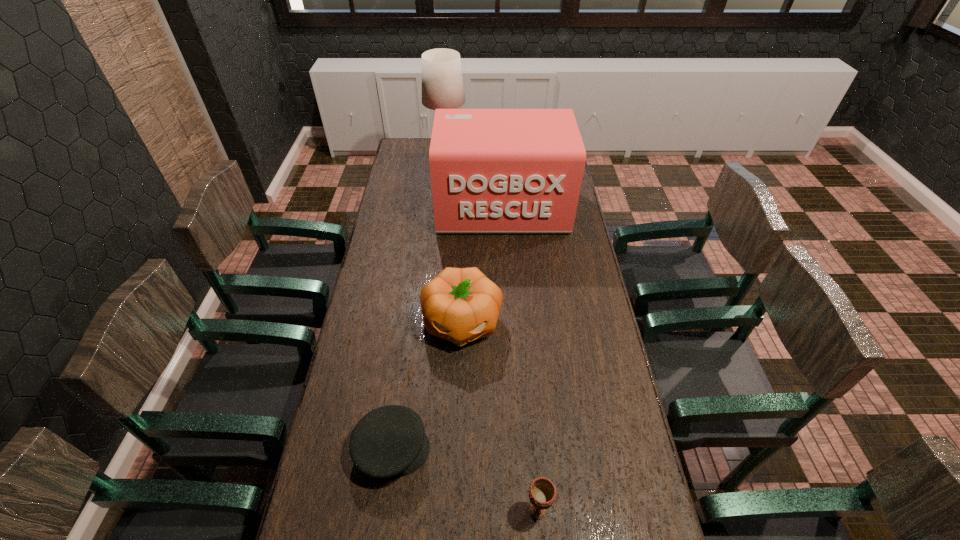
The image size is (960, 540). What are the coordinates of `object that is the third nearest to the second farthest object` in the screenshot? It's located at (389, 441).

At what (x,y) coordinates should I click in order to perform the action: click on object identified as the closest to the second tallest object. Please return your answer as a coordinate pair (x, y). The height and width of the screenshot is (540, 960). Looking at the image, I should click on (442, 83).

Find the location of a particular element. Image resolution: width=960 pixels, height=540 pixels. vacant point that satisfies the following two spatial constraints: 1. on the front-facing side of the beret; 2. on the back side of the nearest object is located at coordinates (384, 510).

At what (x,y) coordinates should I click in order to perform the action: click on free region that satisfies the following two spatial constraints: 1. on the surface of the nearest object where the text is embossed; 2. on the right side of the second farthest object. Please return your answer as a coordinate pair (x, y). The image size is (960, 540). Looking at the image, I should click on (520, 510).

Locate an element on the screen. The width and height of the screenshot is (960, 540). vacant space that satisfies the following two spatial constraints: 1. on the front side of the lamp; 2. on the front-facing side of the second nearest object is located at coordinates (418, 449).

This screenshot has height=540, width=960. I want to click on blank area in the image that satisfies the following two spatial constraints: 1. on the front-facing side of the beret; 2. on the left side of the nearest object, so click(x=384, y=510).

Identify the location of free location that satisfies the following two spatial constraints: 1. on the front-facing side of the nearest object; 2. on the right side of the shortest object. (384, 510).